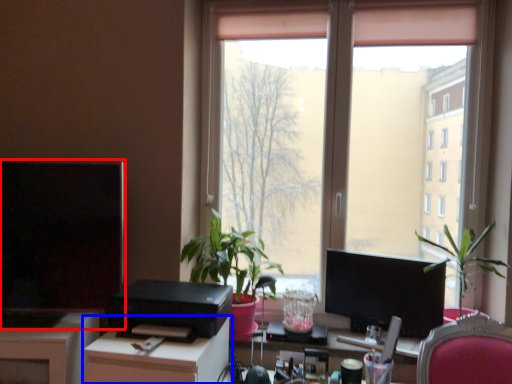
Question: Which of the following is the closest to the observer, computer monitor (highlighted by a red box) or desk (highlighted by a blue box)?

Choices:
 (A) computer monitor
 (B) desk

Answer: (B)